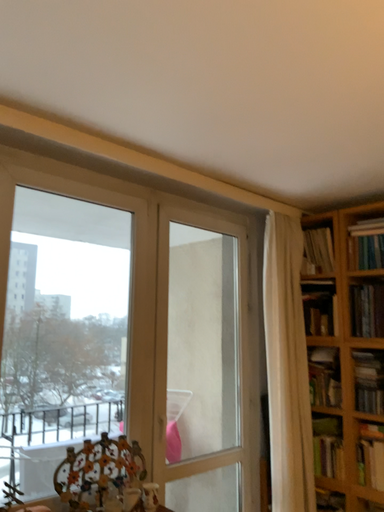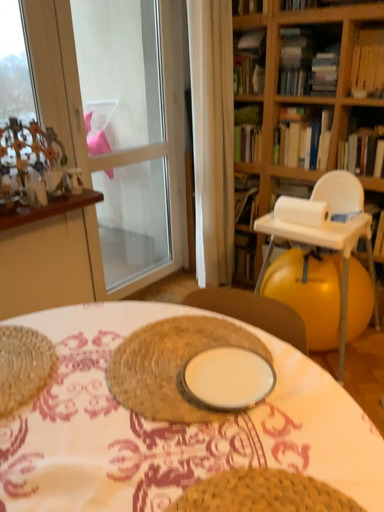
Question: How did the camera likely rotate when shooting the video?

Choices:
 (A) rotated upward
 (B) rotated downward

Answer: (B)